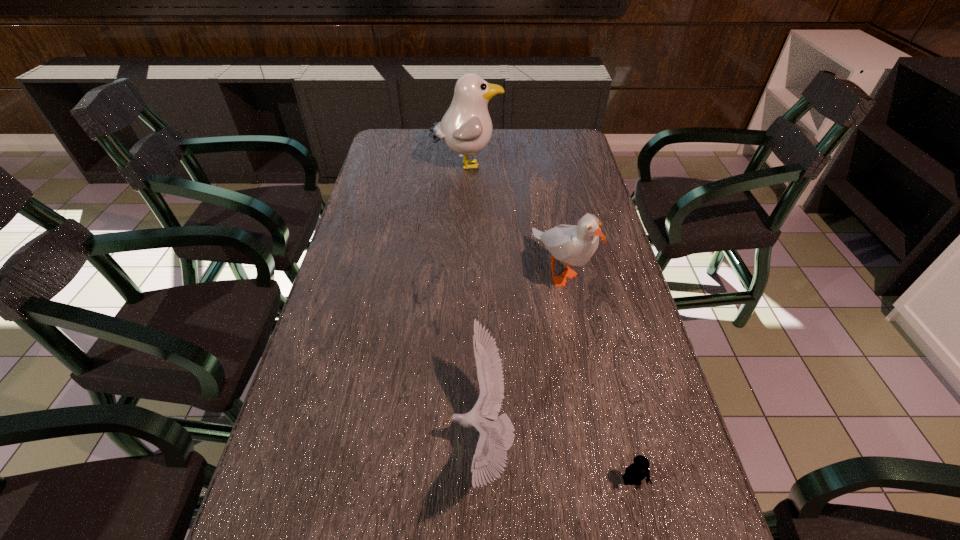
The width and height of the screenshot is (960, 540). I want to click on free space between the tallest gull and the Lego, so click(549, 323).

The width and height of the screenshot is (960, 540). Find the location of `free point between the third nearest object and the third tallest object`. free point between the third nearest object and the third tallest object is located at coordinates (521, 354).

This screenshot has height=540, width=960. In order to click on vacant area that lies between the nearest gull and the rightmost gull in this screenshot , I will do `click(521, 354)`.

Where is `free spot between the second shortest object and the second shortest gull`? The height and width of the screenshot is (540, 960). free spot between the second shortest object and the second shortest gull is located at coordinates (521, 354).

Where is `free space between the shortest object and the farthest object`? This screenshot has width=960, height=540. free space between the shortest object and the farthest object is located at coordinates (549, 323).

Identify the location of blank region between the tallest object and the shortest gull. Image resolution: width=960 pixels, height=540 pixels. (474, 301).

You are a GUI agent. You are given a task and a screenshot of the screen. Output one action in this format:
    pyautogui.click(x=<x>, y=<y>)
    Task: Click on the free point between the Lego and the farthest gull
    
    Given the screenshot: What is the action you would take?
    549,323

Find the location of `free space between the shortest object and the shortest gull`. free space between the shortest object and the shortest gull is located at coordinates (557, 459).

In order to click on object identified as the second closest to the Lego in this screenshot , I will do `click(575, 245)`.

Select which object appears as the third closest to the Lego. Please provide its 2D coordinates. Your answer should be formatted as a tuple, i.e. [(x, y)], where the tuple contains the x and y coordinates of a point satisfying the conditions above.

[(466, 128)]